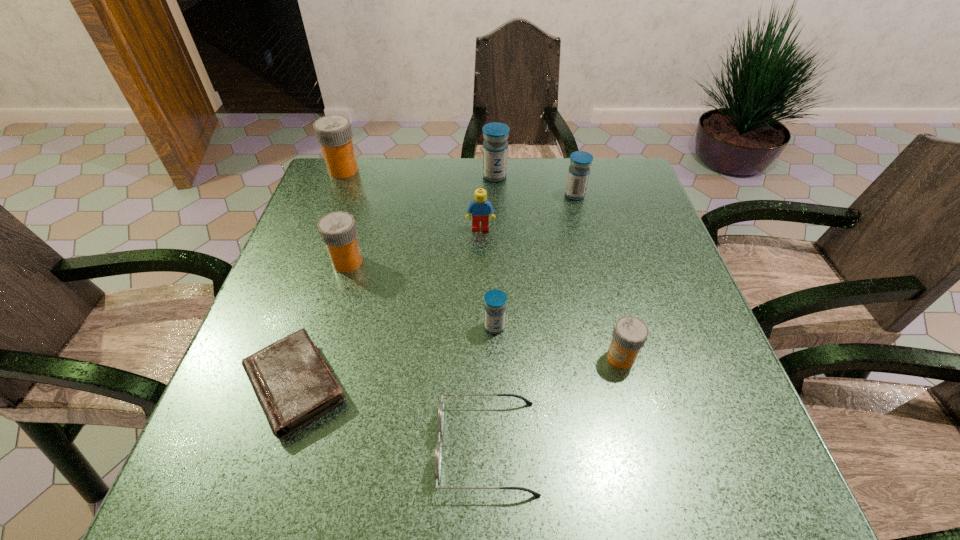
Find the location of `the rightmost orange medicine`. the rightmost orange medicine is located at coordinates (630, 333).

Identify the location of the smallest blue medicine. (495, 300).

The image size is (960, 540). Find the location of `the sixth farthest object`. the sixth farthest object is located at coordinates (495, 300).

Find the location of a particular element. sunglasses is located at coordinates (438, 452).

This screenshot has width=960, height=540. I want to click on diary, so click(x=293, y=384).

Find the location of a particular element. This screenshot has height=540, width=960. free space located 0.380m on the label side of the biggest orange medicine is located at coordinates (487, 170).

This screenshot has width=960, height=540. I want to click on vacant region located on the right of the biggest blue medicine, so click(x=607, y=176).

The width and height of the screenshot is (960, 540). Find the location of `vacant space located on the label side of the second biggest orange medicine`. vacant space located on the label side of the second biggest orange medicine is located at coordinates (524, 262).

Locate an element on the screen. This screenshot has height=540, width=960. vacant space located 0.060m on the back of the second biggest blue medicine is located at coordinates (570, 177).

This screenshot has height=540, width=960. What are the coordinates of `blank space located 0.210m on the face of the Lego` in the screenshot? It's located at 481,295.